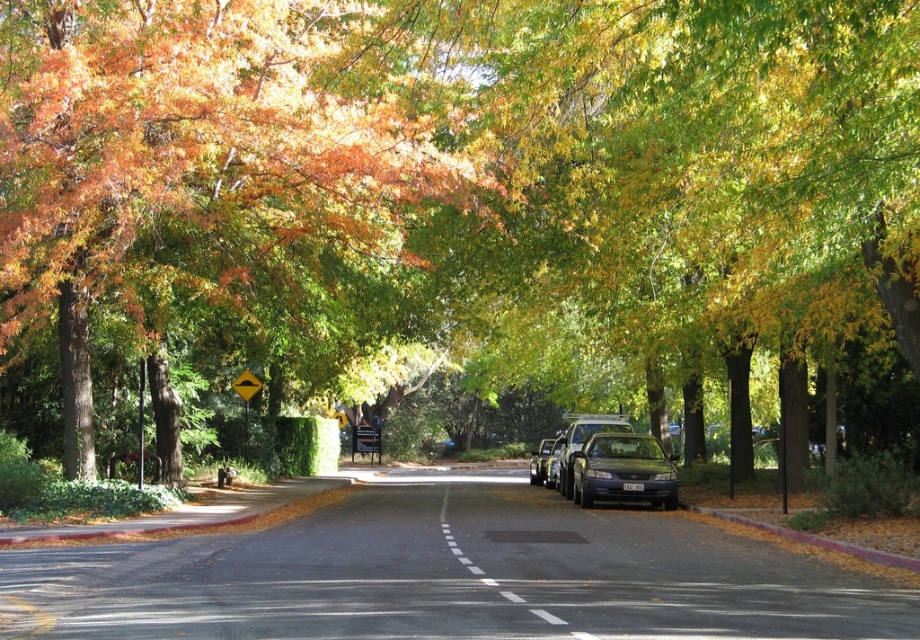
Question: Considering the real-world distances, which object is farthest from the yellow reflective plastic triangle at center?

Choices:
 (A) black asphalt road at center
 (B) shiny black sedan at center
 (C) yellow reflective plastic triangle at upper center

Answer: (B)

Question: Which point is closer to the camera?

Choices:
 (A) black asphalt road at center
 (B) yellow reflective plastic triangle at center

Answer: (A)

Question: Does yellow reflective plastic triangle at upper center appear on the right side of yellow reflective plastic triangle at center?

Choices:
 (A) yes
 (B) no

Answer: (B)

Question: Is metallic gray sedan at center to the right of black asphalt road at center from the viewer's perspective?

Choices:
 (A) no
 (B) yes

Answer: (B)

Question: Is yellow reflective plastic triangle at upper center closer to the viewer compared to yellow reflective plastic triangle at center?

Choices:
 (A) yes
 (B) no

Answer: (B)

Question: Which point is farther to the camera?

Choices:
 (A) (661, 483)
 (B) (240, 394)
 (C) (236, 378)
 (D) (522, 604)

Answer: (C)